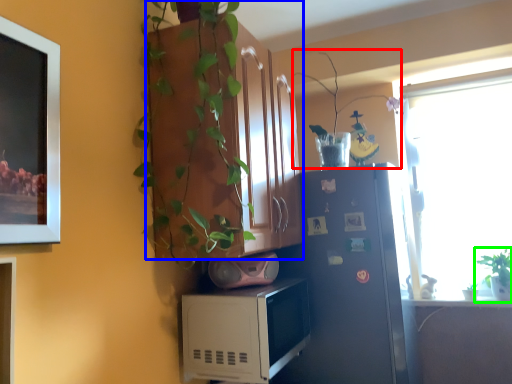
Question: Considering the real-world distances, which object is farthest from plant (highlighted by a red box)? cabinetry (highlighted by a blue box) or houseplant (highlighted by a green box)?

Choices:
 (A) cabinetry
 (B) houseplant

Answer: (A)